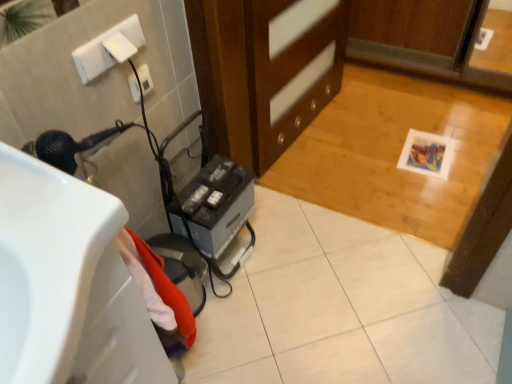
Question: From the image's perspective, is white glossy sink at lower left located beneath wooden cabinet at center?

Choices:
 (A) no
 (B) yes

Answer: (B)

Question: Does white glossy sink at lower left appear on the left side of wooden cabinet at center?

Choices:
 (A) yes
 (B) no

Answer: (A)

Question: Is white glossy sink at lower left wider than wooden cabinet at center?

Choices:
 (A) no
 (B) yes

Answer: (B)

Question: Is white glossy sink at lower left shorter than wooden cabinet at center?

Choices:
 (A) no
 (B) yes

Answer: (B)

Question: Is white glossy sink at lower left bigger than wooden cabinet at center?

Choices:
 (A) yes
 (B) no

Answer: (B)

Question: Is white glossy sink at lower left to the right of wooden cabinet at center from the viewer's perspective?

Choices:
 (A) no
 (B) yes

Answer: (A)

Question: Is metallic gray hair dryer at lower left located within white glossy sink at lower left?

Choices:
 (A) yes
 (B) no

Answer: (B)

Question: Considering the relative sizes of white glossy sink at lower left and metallic gray hair dryer at lower left in the image provided, is white glossy sink at lower left shorter than metallic gray hair dryer at lower left?

Choices:
 (A) yes
 (B) no

Answer: (B)

Question: Can you confirm if white glossy sink at lower left is smaller than metallic gray hair dryer at lower left?

Choices:
 (A) yes
 (B) no

Answer: (B)

Question: Can we say white glossy sink at lower left lies outside metallic gray hair dryer at lower left?

Choices:
 (A) no
 (B) yes

Answer: (B)

Question: Would you consider white glossy sink at lower left to be distant from metallic gray hair dryer at lower left?

Choices:
 (A) no
 (B) yes

Answer: (A)

Question: Does white glossy sink at lower left appear on the left side of metallic gray hair dryer at lower left?

Choices:
 (A) yes
 (B) no

Answer: (A)

Question: Can you confirm if wooden cabinet at center is thinner than white plastic electric outlet at upper left?

Choices:
 (A) yes
 (B) no

Answer: (B)